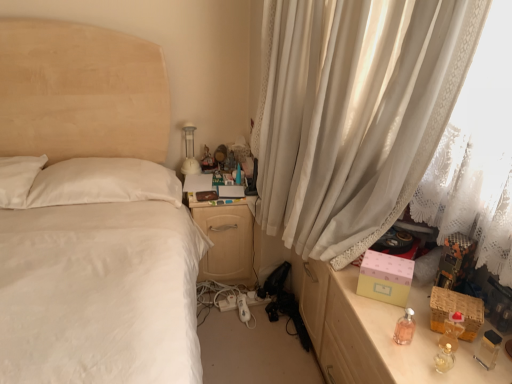
Measure the distance between point (462, 325) and camera.

4.22 feet.

Where is `pink glass perfume at lower right, which is the second perfume in right-to-left order`? This screenshot has height=384, width=512. pink glass perfume at lower right, which is the second perfume in right-to-left order is located at coordinates [x=405, y=328].

Find the location of a particular element. Image resolution: width=512 pixels, height=384 pixels. white glossy table lamp at upper center is located at coordinates (189, 151).

This screenshot has width=512, height=384. Describe the element at coordinates (226, 241) in the screenshot. I see `light wood/wooden nightstand at center` at that location.

What are the coordinates of `matte pink box at right` in the screenshot? It's located at (378, 334).

From the picture: Who is more distant, pink glass perfume at lower right, which is the second perfume in right-to-left order, or translucent amber bottle at right, the 2th perfume in the left-to-right sequence?

pink glass perfume at lower right, which is the second perfume in right-to-left order.

Can we say pink glass perfume at lower right, which is the second perfume in right-to-left order, lies outside translucent amber bottle at right, which is the first perfume from right to left?

Yes, pink glass perfume at lower right, which is the second perfume in right-to-left order, is located beyond the bounds of translucent amber bottle at right, which is the first perfume from right to left.

From the picture: Who is taller, pink glass perfume at lower right, the first perfume in the left-to-right sequence, or translucent amber bottle at right, the 2th perfume in the left-to-right sequence?

Standing taller between the two is translucent amber bottle at right, the 2th perfume in the left-to-right sequence.

From the image's perspective, relative to translucent amber bottle at right, which is the first perfume from right to left, is pink glass perfume at lower right, which is the second perfume in right-to-left order, above or below?

From the image's perspective, pink glass perfume at lower right, which is the second perfume in right-to-left order, appears above translucent amber bottle at right, which is the first perfume from right to left.

Is white sheer curtain at right not close to matte plastic figurine at upper center?

No, white sheer curtain at right is not far from matte plastic figurine at upper center.

What's the angular difference between white sheer curtain at right and matte plastic figurine at upper center's facing directions?

The angle between the facing direction of white sheer curtain at right and the facing direction of matte plastic figurine at upper center is 45.2 degrees.

Which object is closer to the camera taking this photo, white sheer curtain at right or matte plastic figurine at upper center?

white sheer curtain at right.

Considering the relative sizes of white sheer curtain at right and matte plastic figurine at upper center in the image provided, is white sheer curtain at right shorter than matte plastic figurine at upper center?

In fact, white sheer curtain at right may be taller than matte plastic figurine at upper center.

Considering the sizes of objects pink glass perfume at lower right, the first perfume in the left-to-right sequence, and white sheer curtain at right in the image provided, who is smaller, pink glass perfume at lower right, the first perfume in the left-to-right sequence, or white sheer curtain at right?

Smaller between the two is pink glass perfume at lower right, the first perfume in the left-to-right sequence.

Considering the positions of objects pink glass perfume at lower right, the first perfume in the left-to-right sequence, and white sheer curtain at right in the image provided, who is behind, pink glass perfume at lower right, the first perfume in the left-to-right sequence, or white sheer curtain at right?

pink glass perfume at lower right, the first perfume in the left-to-right sequence, is further away from the camera.

Which is farther, [405,334] or [319,133]?

The point [319,133] is behind.

In the image, is pink glass perfume at lower right, which is the second perfume in right-to-left order, on the left side or the right side of white sheer curtain at right?

From the image, it's evident that pink glass perfume at lower right, which is the second perfume in right-to-left order, is to the right of white sheer curtain at right.

Is light wood/wooden nightstand at center positioned with its back to white sheer curtain at right?

No, white sheer curtain at right is not at the back of light wood/wooden nightstand at center.

Considering the sizes of objects light wood/wooden nightstand at center and white sheer curtain at right in the image provided, who is taller, light wood/wooden nightstand at center or white sheer curtain at right?

white sheer curtain at right is taller.

Based on the photo, would you say light wood/wooden nightstand at center contains white sheer curtain at right?

No, light wood/wooden nightstand at center does not contain white sheer curtain at right.

In the scene shown: From a real-world perspective, which is physically below, light wood/wooden nightstand at center or white sheer curtain at right?

From a 3D spatial view, light wood/wooden nightstand at center is below.

Is point (358, 340) behind point (402, 44)?

No, it is in front of (402, 44).

Find the location of `vanity on the right of the white sheer curtain at right`. vanity on the right of the white sheer curtain at right is located at coordinates (378, 334).

Considering the relative sizes of matte pink box at right and white sheer curtain at right in the image provided, is matte pink box at right smaller than white sheer curtain at right?

Indeed, matte pink box at right has a smaller size compared to white sheer curtain at right.

Based on the photo, is white sheer curtain at right completely or partially inside matte pink box at right?

That's incorrect, white sheer curtain at right is not inside matte pink box at right.

Is matte plastic figurine at upper center taller than white glossy table lamp at upper center?

Incorrect, the height of matte plastic figurine at upper center is not larger of that of white glossy table lamp at upper center.

How different are the orientations of matte plastic figurine at upper center and white glossy table lamp at upper center in degrees?

The angle between the facing direction of matte plastic figurine at upper center and the facing direction of white glossy table lamp at upper center is 3.37 degrees.

Does matte plastic figurine at upper center have a lesser width compared to white glossy table lamp at upper center?

Yes, matte plastic figurine at upper center is thinner than white glossy table lamp at upper center.

Is light wood/wooden nightstand at center oriented away from translucent amber bottle at right, the 2th perfume in the left-to-right sequence?

light wood/wooden nightstand at center does not have its back to translucent amber bottle at right, the 2th perfume in the left-to-right sequence.

From the picture: From the image's perspective, is light wood/wooden nightstand at center located beneath translucent amber bottle at right, the 2th perfume in the left-to-right sequence?

No, from the image's perspective, light wood/wooden nightstand at center is not beneath translucent amber bottle at right, the 2th perfume in the left-to-right sequence.

Which is correct: light wood/wooden nightstand at center is inside translucent amber bottle at right, the 2th perfume in the left-to-right sequence, or outside of it?

light wood/wooden nightstand at center is outside translucent amber bottle at right, the 2th perfume in the left-to-right sequence.

Locate an element on the screen. The image size is (512, 384). perfume on the right of the pink glass perfume at lower right, which is the second perfume in right-to-left order is located at coordinates (452, 330).

At what (x,y) coordinates should I click in order to perform the action: click on curtain above the matte plastic figurine at upper center (from a real-world perspective). Please return your answer as a coordinate pair (x, y). This screenshot has height=384, width=512. Looking at the image, I should click on (354, 113).

Based on their spatial positions, is white sheer curtain at right or pink glass perfume at lower right, the first perfume in the left-to-right sequence, closer to translucent amber bottle at right, which is the first perfume from right to left?

pink glass perfume at lower right, the first perfume in the left-to-right sequence.

Estimate the real-world distances between objects in this image. Which object is further from pink glass perfume at lower right, the first perfume in the left-to-right sequence, white glossy table lamp at upper center or white sheer curtain at right?

Among the two, white glossy table lamp at upper center is located further to pink glass perfume at lower right, the first perfume in the left-to-right sequence.

From the image, which object appears to be nearer to pink glass perfume at lower right, the first perfume in the left-to-right sequence, matte pink box at right or white sheer curtain at right?

Among the two, matte pink box at right is located nearer to pink glass perfume at lower right, the first perfume in the left-to-right sequence.

When comparing their distances from white sheer curtain at right, does translucent amber bottle at right, the 2th perfume in the left-to-right sequence, or pink glass perfume at lower right, which is the second perfume in right-to-left order, seem closer?

pink glass perfume at lower right, which is the second perfume in right-to-left order, is positioned closer to the anchor white sheer curtain at right.

Which object lies nearer to the anchor point matte pink box at right, pink glass perfume at lower right, the first perfume in the left-to-right sequence, or translucent amber bottle at right, the 2th perfume in the left-to-right sequence?

pink glass perfume at lower right, the first perfume in the left-to-right sequence, is positioned closer to the anchor matte pink box at right.

Considering their positions, is pink glass perfume at lower right, which is the second perfume in right-to-left order, positioned closer to white sheer curtain at right than white glossy table lamp at upper center?

pink glass perfume at lower right, which is the second perfume in right-to-left order, lies closer to white sheer curtain at right than the other object.

When comparing their distances from pink glass perfume at lower right, the first perfume in the left-to-right sequence, does white glossy table lamp at upper center or matte plastic figurine at upper center seem further?

white glossy table lamp at upper center.

Based on their spatial positions, is white sheer curtain at right or matte pink box at right further from pink glass perfume at lower right, the first perfume in the left-to-right sequence?

Among the two, white sheer curtain at right is located further to pink glass perfume at lower right, the first perfume in the left-to-right sequence.

This screenshot has width=512, height=384. In order to click on table lamp located between pink glass perfume at lower right, the first perfume in the left-to-right sequence, and matte plastic figurine at upper center in the depth direction in this screenshot , I will do `click(189, 151)`.

Identify the location of nightstand between translucent amber bottle at right, which is the first perfume from right to left, and white glossy table lamp at upper center, along the z-axis. This screenshot has height=384, width=512. (226, 241).

Locate an element on the screen. The image size is (512, 384). nightstand positioned between white sheer curtain at right and matte plastic figurine at upper center from near to far is located at coordinates (226, 241).

Identify the location of perfume between translucent amber bottle at right, the 2th perfume in the left-to-right sequence, and white glossy table lamp at upper center in the front-back direction. (405, 328).